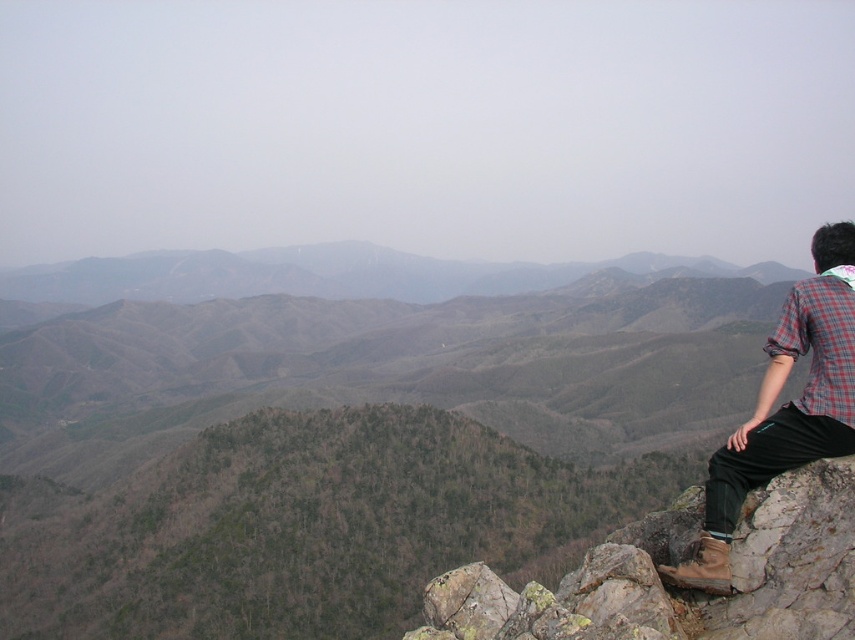
Question: Which of the following is the closest to the observer?

Choices:
 (A) 522,636
 (B) 817,352

Answer: (A)

Question: Can you confirm if brown rocky cliff at right is wider than plaid fabric shirt at right?

Choices:
 (A) no
 (B) yes

Answer: (A)

Question: Among these objects, which one is nearest to the camera?

Choices:
 (A) brown rocky cliff at right
 (B) plaid fabric shirt at right

Answer: (A)

Question: Which of the following is the farthest from the observer?

Choices:
 (A) brown rocky cliff at right
 (B) plaid fabric shirt at right

Answer: (B)

Question: Does brown rocky cliff at right appear on the left side of plaid fabric shirt at right?

Choices:
 (A) no
 (B) yes

Answer: (B)

Question: Is brown rocky cliff at right thinner than plaid fabric shirt at right?

Choices:
 (A) yes
 (B) no

Answer: (A)